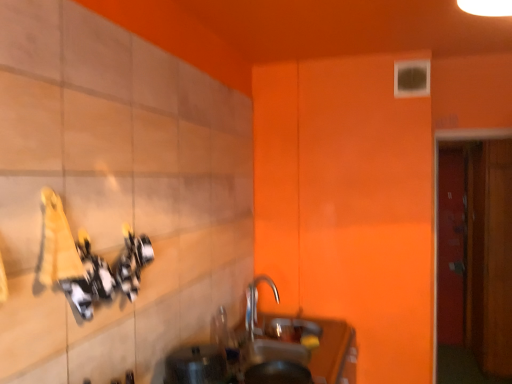
This screenshot has width=512, height=384. What are the coordinates of `wooden door at right, the 2th door when ordered from right to left` in the screenshot? It's located at (438, 201).

This screenshot has height=384, width=512. What do you see at coordinates (438, 201) in the screenshot?
I see `wooden door at right, the 1th door in the front-to-back sequence` at bounding box center [438, 201].

What do you see at coordinates (196, 365) in the screenshot?
I see `metallic silver sink at lower center` at bounding box center [196, 365].

I want to click on silver metallic tap at center, so click(x=256, y=302).

How much distance is there between metallic silver sink at lower center and wooden door at right, acting as the 1th door starting from the right?

metallic silver sink at lower center and wooden door at right, acting as the 1th door starting from the right, are 3.31 meters apart.

From a real-world perspective, relative to wooden door at right, which is counted as the 2th door, starting from the left, is metallic silver sink at lower center vertically above or below?

From a real-world perspective, metallic silver sink at lower center is physically above wooden door at right, which is counted as the 2th door, starting from the left.

Looking at the image, does metallic silver sink at lower center seem bigger or smaller compared to wooden door at right, acting as the 1th door starting from the right?

In the image, metallic silver sink at lower center appears to be smaller than wooden door at right, acting as the 1th door starting from the right.

Could you tell me if metallic silver sink at lower center is turned towards wooden door at right, the second door from the front?

No, metallic silver sink at lower center is not aimed at wooden door at right, the second door from the front.

Considering the points (439, 132) and (259, 279), which point is in front, point (439, 132) or point (259, 279)?

The point (439, 132) is closer.

Can you tell me how much wooden door at right, the 1th door in the front-to-back sequence, and silver metallic tap at center differ in facing direction?

There is a 87-degree angle between the facing directions of wooden door at right, the 1th door in the front-to-back sequence, and silver metallic tap at center.

Is wooden door at right, which appears as the 2th door when viewed from the back, not close to silver metallic tap at center?

wooden door at right, which appears as the 2th door when viewed from the back, is far away from silver metallic tap at center.

Which object is positioned more to the left, wooden door at right, which appears as the 2th door when viewed from the back, or silver metallic tap at center?

silver metallic tap at center is more to the left.

Is metallic silver sink at lower center outside of silver metallic tap at center?

Indeed, metallic silver sink at lower center is completely outside silver metallic tap at center.

Is metallic silver sink at lower center oriented away from silver metallic tap at center?

That's not correct — metallic silver sink at lower center is not looking away from silver metallic tap at center.

Identify the location of tap behind the metallic silver sink at lower center. (256, 302).

From the image's perspective, who appears lower, metallic silver sink at lower center or silver metallic tap at center?

metallic silver sink at lower center.

Is smooth brown countertop at lower center positioned far away from metallic silver sink at lower center?

No, smooth brown countertop at lower center is not far away from metallic silver sink at lower center.

Which of these two, smooth brown countertop at lower center or metallic silver sink at lower center, stands taller?

With more height is smooth brown countertop at lower center.

Which point is more distant from viewer, (353, 334) or (216, 350)?

The point (353, 334) is farther from the camera.

Can you confirm if smooth brown countertop at lower center is positioned to the left of metallic silver sink at lower center?

In fact, smooth brown countertop at lower center is to the right of metallic silver sink at lower center.

Can you confirm if smooth brown countertop at lower center is taller than silver metallic tap at center?

Correct, smooth brown countertop at lower center is much taller as silver metallic tap at center.

Measure the distance from smooth brown countertop at lower center to silver metallic tap at center.

18.25 inches.

Is smooth brown countertop at lower center with silver metallic tap at center?

No, smooth brown countertop at lower center is not with silver metallic tap at center.

From a real-world perspective, between smooth brown countertop at lower center and silver metallic tap at center, who is vertically lower?

smooth brown countertop at lower center, from a real-world perspective.

Considering the relative sizes of wooden door at right, the 2th door when ordered from right to left, and wooden door at right, the 1th door viewed from the back, in the image provided, is wooden door at right, the 2th door when ordered from right to left, taller than wooden door at right, the 1th door viewed from the back,?

No.

Considering the sizes of objects wooden door at right, which is counted as the 1th door, starting from the left, and wooden door at right, the 1th door viewed from the back, in the image provided, who is bigger, wooden door at right, which is counted as the 1th door, starting from the left, or wooden door at right, the 1th door viewed from the back,?

wooden door at right, which is counted as the 1th door, starting from the left.

Locate an element on the screen. door on the left of wooden door at right, the 1th door viewed from the back is located at coordinates pos(438,201).

From the image's perspective, which is above, wooden door at right, which is counted as the 1th door, starting from the left, or metallic silver sink at lower center?

wooden door at right, which is counted as the 1th door, starting from the left.

Consider the image. Who is more distant, wooden door at right, which appears as the 2th door when viewed from the back, or metallic silver sink at lower center?

wooden door at right, which appears as the 2th door when viewed from the back, is behind.

Which is correct: wooden door at right, which appears as the 2th door when viewed from the back, is inside metallic silver sink at lower center, or outside of it?

wooden door at right, which appears as the 2th door when viewed from the back, is outside metallic silver sink at lower center.

Consider the image. Which of these two, wooden door at right, the 1th door in the front-to-back sequence, or metallic silver sink at lower center, is wider?

With larger width is metallic silver sink at lower center.

This screenshot has width=512, height=384. I want to click on appliance on the left of wooden door at right, the 1th door viewed from the back, so click(x=196, y=365).

Identify the location of tap that is under the wooden door at right, the 2th door when ordered from right to left (from a real-world perspective). This screenshot has height=384, width=512. (256, 302).

Looking at the image, which one is located further to metallic silver sink at lower center, silver metallic tap at center or wooden door at right, which is counted as the 1th door, starting from the left?

wooden door at right, which is counted as the 1th door, starting from the left.

Looking at the image, which one is located further to smooth brown countertop at lower center, wooden door at right, the 1th door viewed from the back, or silver metallic tap at center?

Among the two, wooden door at right, the 1th door viewed from the back, is located further to smooth brown countertop at lower center.

From the image, which object appears to be farther from smooth brown countertop at lower center, wooden door at right, the 1th door viewed from the back, or metallic silver sink at lower center?

Based on the image, wooden door at right, the 1th door viewed from the back, appears to be further to smooth brown countertop at lower center.

From the image, which object appears to be nearer to smooth brown countertop at lower center, wooden door at right, which is counted as the 1th door, starting from the left, or metallic silver sink at lower center?

metallic silver sink at lower center.

From the image, which object appears to be farther from silver metallic tap at center, wooden door at right, acting as the 1th door starting from the right, or metallic silver sink at lower center?

Among the two, wooden door at right, acting as the 1th door starting from the right, is located further to silver metallic tap at center.

Considering their positions, is smooth brown countertop at lower center positioned further to silver metallic tap at center than wooden door at right, the 1th door in the front-to-back sequence?

wooden door at right, the 1th door in the front-to-back sequence, lies further to silver metallic tap at center than the other object.

Which object lies nearer to the anchor point metallic silver sink at lower center, wooden door at right, the 1th door in the front-to-back sequence, or silver metallic tap at center?

silver metallic tap at center is closer to metallic silver sink at lower center.

Estimate the real-world distances between objects in this image. Which object is further from wooden door at right, the second door from the front, wooden door at right, the 2th door when ordered from right to left, or silver metallic tap at center?

silver metallic tap at center is further to wooden door at right, the second door from the front.

This screenshot has height=384, width=512. In order to click on door positioned between silver metallic tap at center and wooden door at right, the second door from the front, from near to far in this screenshot , I will do [438, 201].

Where is `tap between metallic silver sink at lower center and wooden door at right, which is counted as the 1th door, starting from the left, in the horizontal direction`? Image resolution: width=512 pixels, height=384 pixels. tap between metallic silver sink at lower center and wooden door at right, which is counted as the 1th door, starting from the left, in the horizontal direction is located at coordinates (256, 302).

I want to click on tap between smooth brown countertop at lower center and wooden door at right, the 1th door viewed from the back, along the z-axis, so click(256, 302).

Locate an element on the screen. tap between metallic silver sink at lower center and wooden door at right, acting as the 1th door starting from the right, from front to back is located at coordinates (256, 302).